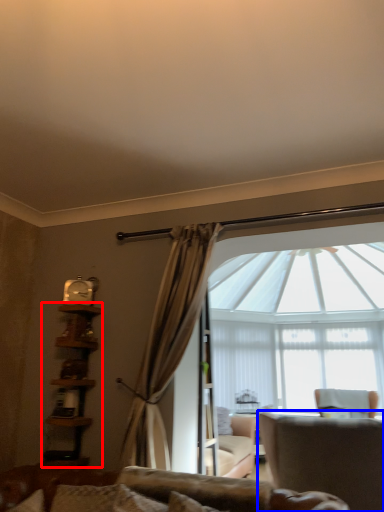
Question: Which object is further to the camera taking this photo, bookshelf (highlighted by a red box) or chair (highlighted by a blue box)?

Choices:
 (A) bookshelf
 (B) chair

Answer: (A)